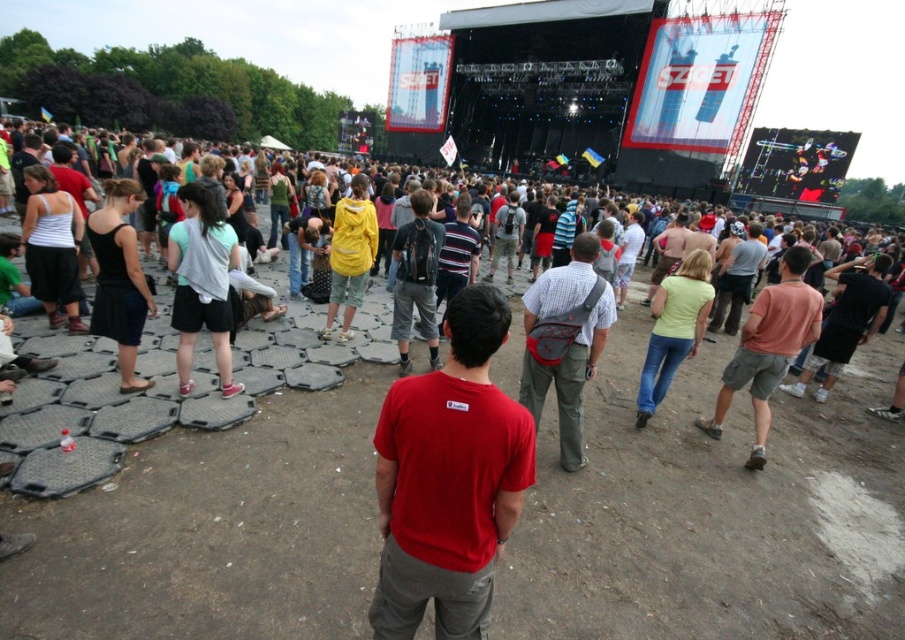
Question: Is plaid cotton shirt at center wider than dark gray shorts at lower right?

Choices:
 (A) yes
 (B) no

Answer: (B)

Question: Which point is closer to the camera?

Choices:
 (A) (795, 301)
 (B) (834, 368)
 (C) (519, 432)
 (D) (565, 419)

Answer: (C)

Question: Which point is closer to the camera taking this photo?

Choices:
 (A) (577, 244)
 (B) (845, 316)
 (C) (459, 355)

Answer: (C)

Question: Where is red cotton t-shirt at center located in relation to light pink cotton t-shirt at right in the image?

Choices:
 (A) left
 (B) right

Answer: (A)

Question: Can you confirm if light pink cotton t-shirt at right is positioned to the right of dark gray shorts at lower right?

Choices:
 (A) yes
 (B) no

Answer: (B)

Question: Estimate the real-world distances between objects in this image. Which object is closer to the red cotton t-shirt at center?

Choices:
 (A) plaid cotton shirt at center
 (B) light pink cotton t-shirt at right
 (C) dark gray shorts at lower right

Answer: (A)